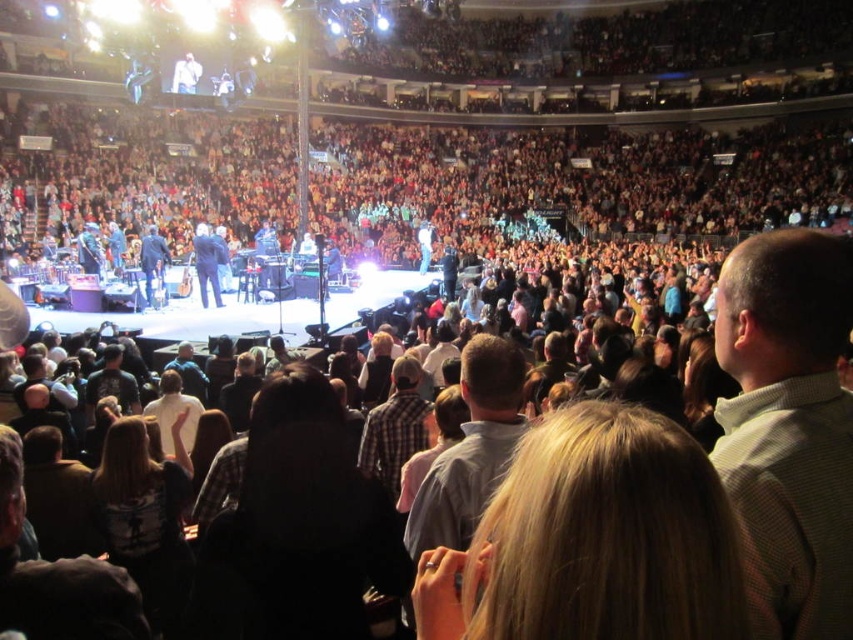
Locate an element on the screen. The width and height of the screenshot is (853, 640). blonde hair at center is located at coordinates (593, 540).

Is point (596, 552) closer to viewer compared to point (155, 397)?

Yes, it is in front of point (155, 397).

Is point (469, 584) behind point (173, 442)?

No, it is not.

The height and width of the screenshot is (640, 853). In order to click on blonde hair at center in this screenshot , I will do `click(593, 540)`.

How distant is light brown checkered shirt at center from white cotton shirt at center?

21.88 meters

Who is higher up, light brown checkered shirt at center or white cotton shirt at center?

Positioned higher is light brown checkered shirt at center.

Which is behind, point (819, 627) or point (157, 420)?

Point (157, 420)

The width and height of the screenshot is (853, 640). Identify the location of light brown checkered shirt at center. (788, 426).

Does blonde hair at center come behind light brown checkered shirt at center?

No, blonde hair at center is in front of light brown checkered shirt at center.

At what (x,y) coordinates should I click in order to perform the action: click on blonde hair at center. Please return your answer as a coordinate pair (x, y). Looking at the image, I should click on (593, 540).

Is point (596, 612) closer to viewer compared to point (776, 340)?

Yes, point (596, 612) is closer to viewer.

Where is `blonde hair at center`? The width and height of the screenshot is (853, 640). blonde hair at center is located at coordinates 593,540.